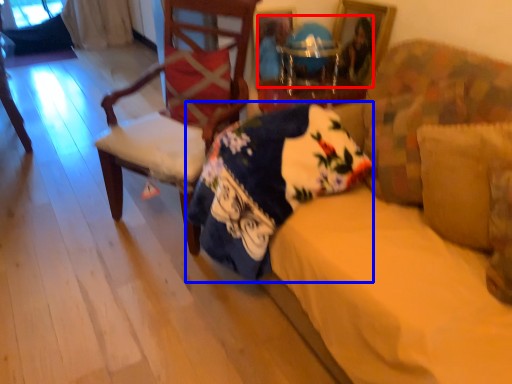
Question: Among these objects, which one is farthest to the camera, couple (highlighted by a red box) or blanket (highlighted by a blue box)?

Choices:
 (A) couple
 (B) blanket

Answer: (A)